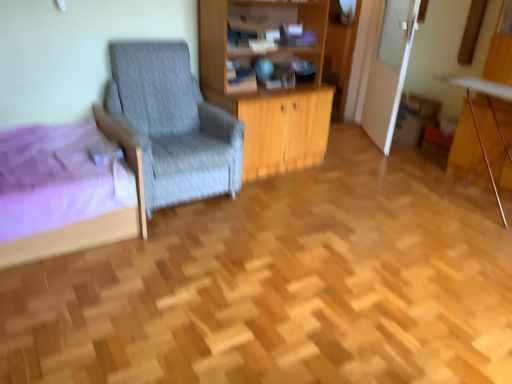
Image resolution: width=512 pixels, height=384 pixels. What are the coordinates of `vacant area that is in front of purple fabric bed at lower left` in the screenshot? It's located at (72, 301).